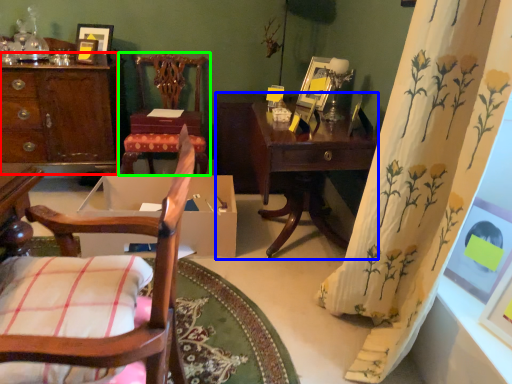
Question: Which object is the farthest from desk (highlighted by a red box)? Choose among these: table (highlighted by a blue box) or chair (highlighted by a green box).

Choices:
 (A) table
 (B) chair

Answer: (A)